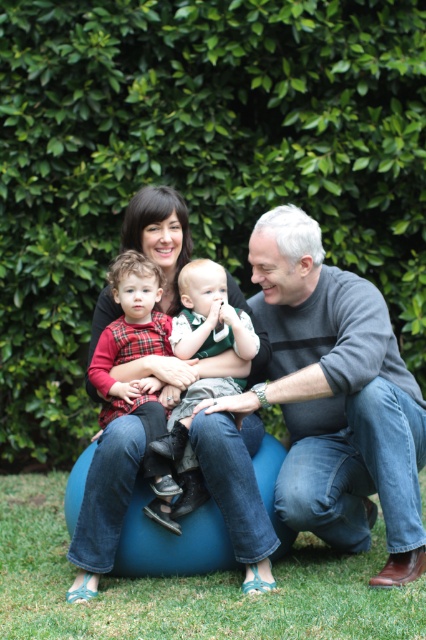
Is green leafy hedge at upper center shorter than green grass at lower center?

Incorrect, green leafy hedge at upper center's height does not fall short of green grass at lower center's.

Does green leafy hedge at upper center appear under green grass at lower center?

No.

Who is more forward, [296,132] or [334,593]?

Point [334,593]

At what (x,y) coordinates should I click in order to perform the action: click on green leafy hedge at upper center. Please return your answer as a coordinate pair (x, y). The width and height of the screenshot is (426, 640). Looking at the image, I should click on (195, 163).

Is point (342, 353) positioned after point (227, 609)?

Yes, it is behind point (227, 609).

Does gray sweater at center have a larger size compared to green grass at lower center?

Yes, gray sweater at center is bigger than green grass at lower center.

Describe the element at coordinates (336, 397) in the screenshot. I see `gray sweater at center` at that location.

In order to click on gray sweater at center in this screenshot , I will do `click(336, 397)`.

Who is lower down, green leafy hedge at upper center or flannel shirt at center?

flannel shirt at center

Does green leafy hedge at upper center have a smaller size compared to flannel shirt at center?

No.

Who is more distant from viewer, [184,154] or [164,435]?

Point [184,154]

Identify the location of green leafy hedge at upper center. point(195,163).